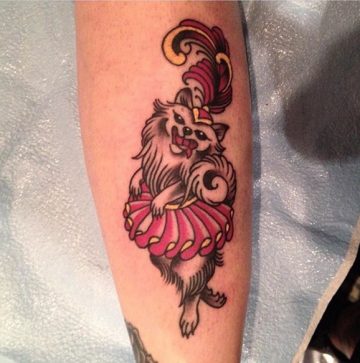
Identify the location of blanket or cloth. This screenshot has width=360, height=363. (51, 232).